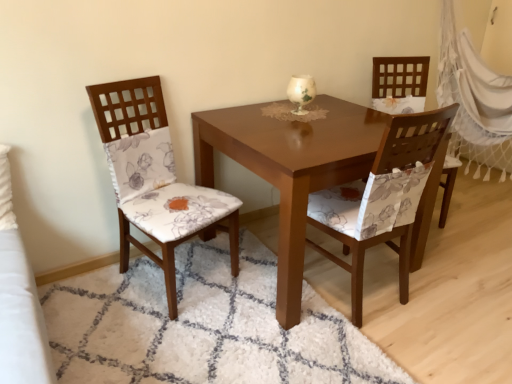
Where is `vacant space in front of white ceramic vase at center`? This screenshot has width=512, height=384. vacant space in front of white ceramic vase at center is located at coordinates (297, 115).